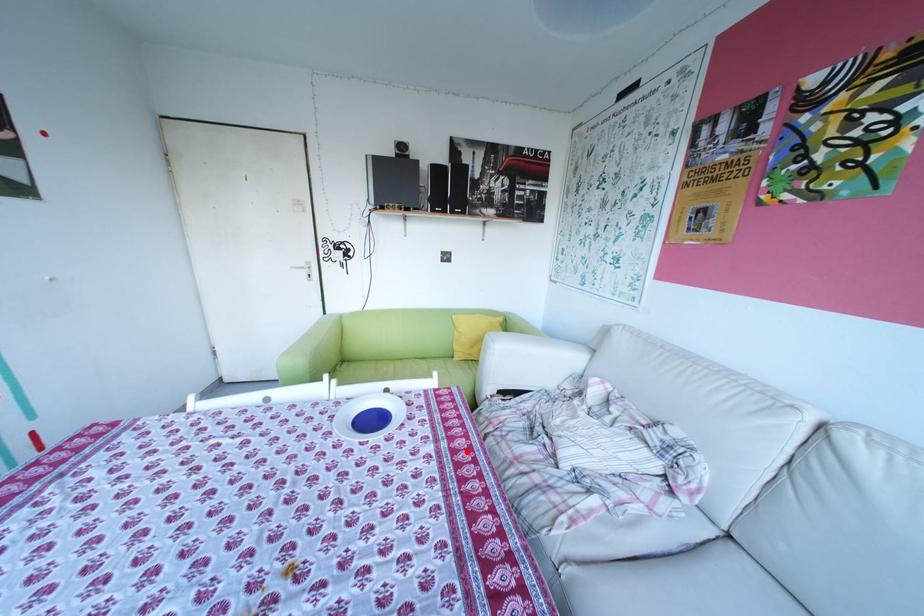
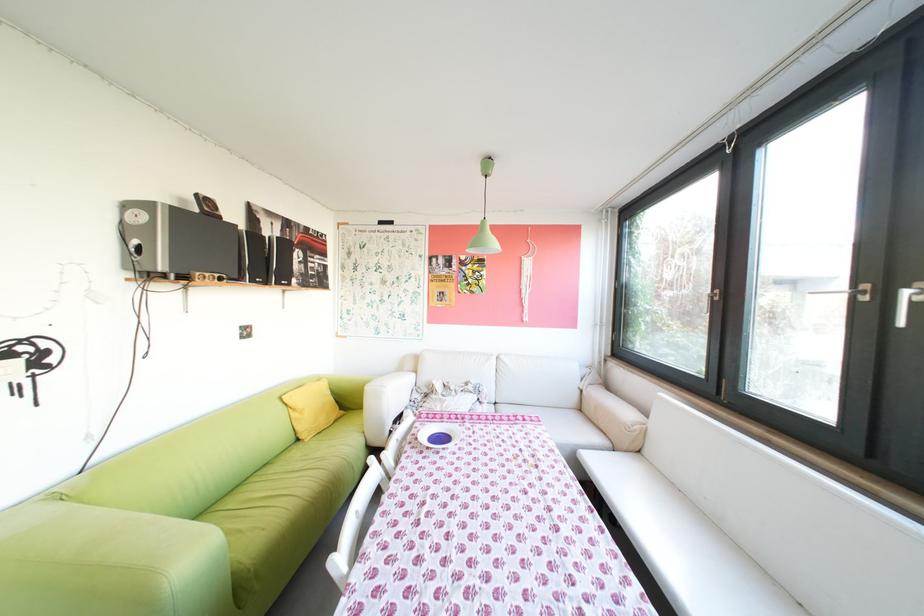
Locate, in the second image, the point that corresponds to the highlighted location in the first image.

(484, 419)